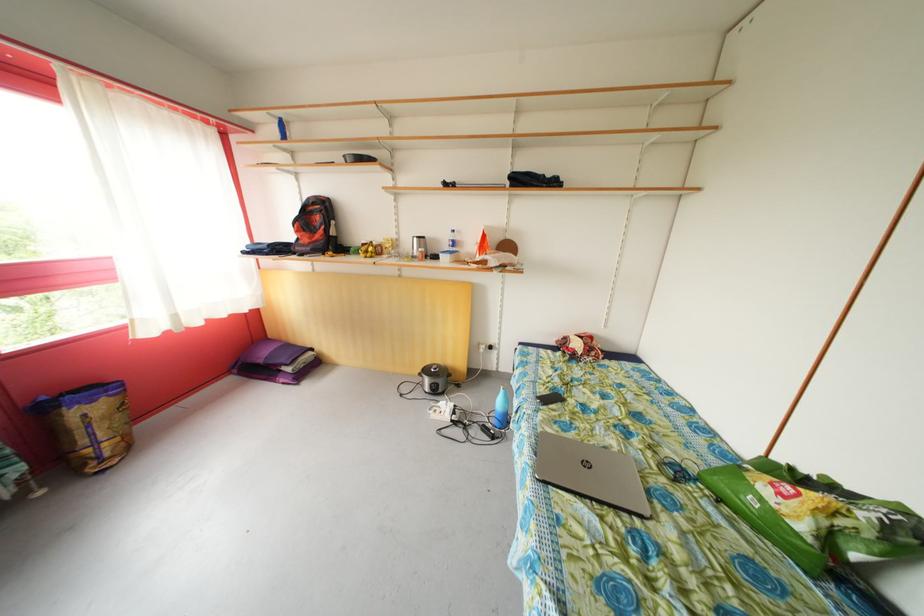
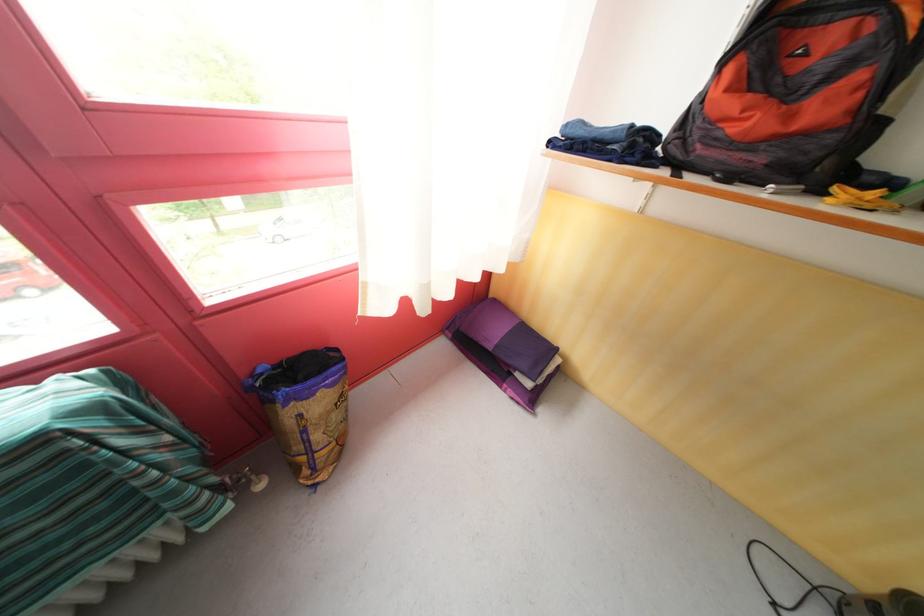
Find the pixel in the second image that matches [310,252] in the first image.

(736, 151)